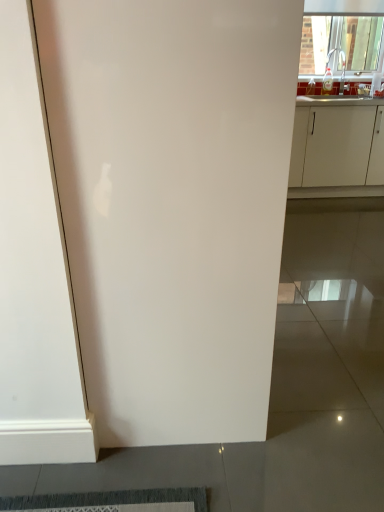
This screenshot has width=384, height=512. Describe the element at coordinates (173, 204) in the screenshot. I see `white glossy door at center` at that location.

In order to face white matte cabinet at right, should I rotate leftwards or rightwards?

To face it directly, rotate right by 19.860 degrees.

Locate an element on the screen. white glossy door at center is located at coordinates coord(173,204).

Which of these two, transparent glass window at upper right or white glossy door at center, stands taller?

white glossy door at center.

Which of these two, transparent glass window at upper right or white glossy door at center, is bigger?

Bigger between the two is white glossy door at center.

At what (x,y) coordinates should I click in order to perform the action: click on window above the white glossy door at center (from a real-world perspective). Please return your answer as a coordinate pair (x, y). The height and width of the screenshot is (512, 384). Looking at the image, I should click on coord(341,35).

How different are the orientations of transparent glass window at upper right and white glossy door at center in degrees?

The angle between the facing direction of transparent glass window at upper right and the facing direction of white glossy door at center is 90 degrees.

Is white matte cabinet at right oriented away from transparent glass window at upper right?

No, white matte cabinet at right's orientation is not away from transparent glass window at upper right.

Would you consider white matte cabinet at right to be distant from transparent glass window at upper right?

Indeed, white matte cabinet at right is not near transparent glass window at upper right.

Which of these two, white matte cabinet at right or transparent glass window at upper right, stands shorter?

transparent glass window at upper right is shorter.

From a real-world perspective, between white matte cabinet at right and transparent glass window at upper right, who is vertically higher?

transparent glass window at upper right is physically above.

Considering their positions, is white glossy door at center located in front of or behind white matte cabinet at right?

In the image, white glossy door at center appears in front of white matte cabinet at right.

Is white glossy door at center situated inside white matte cabinet at right or outside?

white glossy door at center is located beyond the bounds of white matte cabinet at right.

Locate an element on the screen. This screenshot has height=512, width=384. door to the left of white matte cabinet at right is located at coordinates (173, 204).

From a real-world perspective, is white glossy door at center physically located above or below white matte cabinet at right?

white glossy door at center is above white matte cabinet at right.

Can you tell me how much white glossy door at center and transparent glass window at upper right differ in facing direction?

white glossy door at center and transparent glass window at upper right are facing 90 degrees away from each other.

Considering the relative sizes of white glossy door at center and transparent glass window at upper right in the image provided, is white glossy door at center taller than transparent glass window at upper right?

Correct, white glossy door at center is much taller as transparent glass window at upper right.

Is white glossy door at center facing away from transparent glass window at upper right?

That's not correct — white glossy door at center is not looking away from transparent glass window at upper right.

Would you say white matte cabinet at right is to the left or to the right of white glossy door at center in the picture?

Based on their positions, white matte cabinet at right is located to the right of white glossy door at center.

Who is smaller, white matte cabinet at right or white glossy door at center?

With smaller size is white glossy door at center.

Is white matte cabinet at right facing towards white glossy door at center?

Yes, white matte cabinet at right is facing white glossy door at center.

From the image's perspective, is white matte cabinet at right on white glossy door at center?

Yes, from the image's perspective, white matte cabinet at right is above white glossy door at center.

Is transparent glass window at upper right positioned far away from white matte cabinet at right?

Indeed, transparent glass window at upper right is not near white matte cabinet at right.

From the image's perspective, which is below, transparent glass window at upper right or white matte cabinet at right?

white matte cabinet at right, from the image's perspective.

Is transparent glass window at upper right closer to camera compared to white matte cabinet at right?

That is False.

Is transparent glass window at upper right looking in the opposite direction of white matte cabinet at right?

transparent glass window at upper right does not have its back to white matte cabinet at right.

You are a GUI agent. You are given a task and a screenshot of the screen. Output one action in this format:
    pyautogui.click(x=<x>, y=<y>)
    Task: Click on the window above the white glossy door at center (from a real-world perspective)
    The image size is (384, 512).
    Given the screenshot: What is the action you would take?
    pyautogui.click(x=341, y=35)

Locate an element on the screen. Image resolution: width=384 pixels, height=512 pixels. window that is behind the white matte cabinet at right is located at coordinates [x=341, y=35].

Looking at the image, which one is located closer to white glossy door at center, transparent glass window at upper right or white matte cabinet at right?

The object closer to white glossy door at center is white matte cabinet at right.

Estimate the real-world distances between objects in this image. Which object is further from white glossy door at center, white matte cabinet at right or transparent glass window at upper right?

The object further to white glossy door at center is transparent glass window at upper right.

Which object lies further to the anchor point white matte cabinet at right, white glossy door at center or transparent glass window at upper right?

white glossy door at center is positioned further to the anchor white matte cabinet at right.

Based on the photo, which object lies nearer to the anchor point transparent glass window at upper right, white glossy door at center or white matte cabinet at right?

Based on the image, white matte cabinet at right appears to be nearer to transparent glass window at upper right.

Considering their positions, is transparent glass window at upper right positioned closer to white matte cabinet at right than white glossy door at center?

transparent glass window at upper right.

Based on the photo, considering their positions, is white matte cabinet at right positioned further to transparent glass window at upper right than white glossy door at center?

The object further to transparent glass window at upper right is white glossy door at center.

This screenshot has height=512, width=384. Identify the location of cabinetry between white glossy door at center and transparent glass window at upper right in the front-back direction. (337, 143).